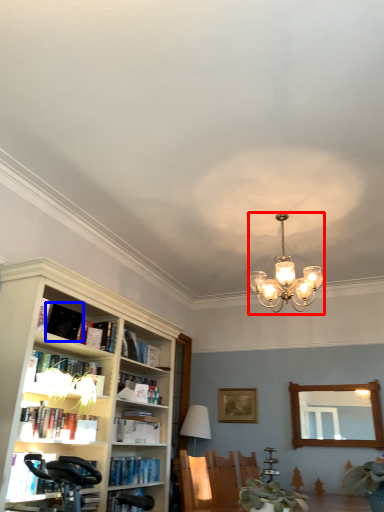
Question: Among these objects, which one is farthest to the camera, lamp (highlighted by a red box) or book (highlighted by a blue box)?

Choices:
 (A) lamp
 (B) book

Answer: (B)